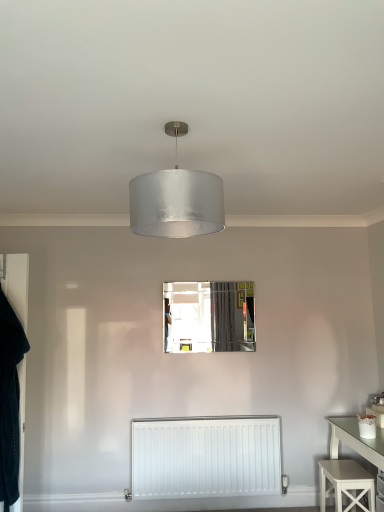
Locate an element on the screen. This screenshot has height=512, width=384. white painted wood stool at lower right is located at coordinates (346, 484).

The height and width of the screenshot is (512, 384). Describe the element at coordinates (176, 199) in the screenshot. I see `satin silver shade at center` at that location.

The width and height of the screenshot is (384, 512). What are the coordinates of `white painted wood stool at lower right` in the screenshot? It's located at (346, 484).

Is clear glass mirror at center outside of white painted wood stool at lower right?

That's correct, clear glass mirror at center is outside of white painted wood stool at lower right.

Looking at this image, is clear glass mirror at center facing towards white painted wood stool at lower right?

No, clear glass mirror at center is not aimed at white painted wood stool at lower right.

Can you confirm if clear glass mirror at center is positioned to the right of white painted wood stool at lower right?

No.

Does point (243, 301) come farther from viewer compared to point (344, 465)?

Yes.

Is velvet black robe at left smaller than white matte radiator at lower center?

Correct, velvet black robe at left occupies less space than white matte radiator at lower center.

Considering the relative positions of velvet black robe at left and white matte radiator at lower center in the image provided, is velvet black robe at left in front of white matte radiator at lower center?

Yes, it is.

From the image's perspective, which is above, velvet black robe at left or white matte radiator at lower center?

velvet black robe at left is shown above in the image.

Identify the location of radiator that is under the velvet black robe at left (from a real-world perspective). [x=205, y=457].

From a real-world perspective, is clear glass mirror at center located beneath white matte radiator at lower center?

No, from a real-world perspective, clear glass mirror at center is not under white matte radiator at lower center.

How distant is clear glass mirror at center from white matte radiator at lower center?

clear glass mirror at center is 33.72 inches away from white matte radiator at lower center.

Where is `radiator on the right of the clear glass mirror at center`? The width and height of the screenshot is (384, 512). radiator on the right of the clear glass mirror at center is located at coordinates (205, 457).

Which object is further away from the camera taking this photo, clear glass mirror at center or white matte radiator at lower center?

Positioned behind is clear glass mirror at center.

Between satin silver shade at center and velvet black robe at left, which one has more height?

Standing taller between the two is velvet black robe at left.

Considering the positions of point (173, 236) and point (12, 418), is point (173, 236) closer or farther from the camera than point (12, 418)?

Clearly, point (173, 236) is closer to the camera than point (12, 418).

Is satin silver shade at center positioned beyond the bounds of velvet black robe at left?

Yes.

Between satin silver shade at center and velvet black robe at left, which one has larger size?

Bigger between the two is satin silver shade at center.

Looking at this image, between clear glass mirror at center and velvet black robe at left, which one is positioned behind?

clear glass mirror at center.

How different are the orientations of clear glass mirror at center and velvet black robe at left in degrees?

The angle between the facing direction of clear glass mirror at center and the facing direction of velvet black robe at left is 5.43 degrees.

Is clear glass mirror at center not close to velvet black robe at left?

That's right, there is a large distance between clear glass mirror at center and velvet black robe at left.

How much distance is there between clear glass mirror at center and velvet black robe at left?

The distance of clear glass mirror at center from velvet black robe at left is 5.03 feet.

What's the angular difference between velvet black robe at left and satin silver shade at center's facing directions?

83.1 degrees separate the facing orientations of velvet black robe at left and satin silver shade at center.

Is velvet black robe at left taller than satin silver shade at center?

Yes.

Would you say velvet black robe at left is inside or outside satin silver shade at center?

A: velvet black robe at left cannot be found inside satin silver shade at center.

Between velvet black robe at left and satin silver shade at center, which one appears on the right side from the viewer's perspective?

From the viewer's perspective, satin silver shade at center appears more on the right side.

Is white painted wood stool at lower right bigger or smaller than white matte radiator at lower center?

In the image, white painted wood stool at lower right appears to be smaller than white matte radiator at lower center.

Is white painted wood stool at lower right shorter than white matte radiator at lower center?

Correct, white painted wood stool at lower right is not as tall as white matte radiator at lower center.

Between white painted wood stool at lower right and white matte radiator at lower center, which one appears on the right side from the viewer's perspective?

white painted wood stool at lower right.

Considering their positions, is white painted wood stool at lower right located in front of or behind white matte radiator at lower center?

white painted wood stool at lower right is in front of white matte radiator at lower center.

What are the coordinates of `mirror located above the white painted wood stool at lower right (from the image's perspective)` in the screenshot? It's located at (209, 316).

Where is `clothing lying on the left of white matte radiator at lower center`? The width and height of the screenshot is (384, 512). clothing lying on the left of white matte radiator at lower center is located at coordinates pyautogui.click(x=10, y=400).

Consider the image. From the image, which object appears to be farther from satin silver shade at center, white painted wood stool at lower right or velvet black robe at left?

Among the two, white painted wood stool at lower right is located further to satin silver shade at center.

From the image, which object appears to be farther from white matte radiator at lower center, clear glass mirror at center or white painted wood stool at lower right?

clear glass mirror at center is positioned further to the anchor white matte radiator at lower center.

Which object lies further to the anchor point velvet black robe at left, clear glass mirror at center or white matte radiator at lower center?

clear glass mirror at center.

From the image, which object appears to be nearer to velvet black robe at left, clear glass mirror at center or white painted wood stool at lower right?

Based on the image, clear glass mirror at center appears to be nearer to velvet black robe at left.

Based on their spatial positions, is white painted wood stool at lower right or satin silver shade at center further from velvet black robe at left?

white painted wood stool at lower right.

Looking at the image, which one is located closer to clear glass mirror at center, velvet black robe at left or satin silver shade at center?

velvet black robe at left lies closer to clear glass mirror at center than the other object.

Considering their positions, is velvet black robe at left positioned further to satin silver shade at center than white matte radiator at lower center?

Among the two, white matte radiator at lower center is located further to satin silver shade at center.

Estimate the real-world distances between objects in this image. Which object is closer to clear glass mirror at center, satin silver shade at center or velvet black robe at left?

Among the two, velvet black robe at left is located nearer to clear glass mirror at center.

Find the location of a particular element. The image size is (384, 512). clothing between satin silver shade at center and white matte radiator at lower center vertically is located at coordinates (10, 400).

I want to click on radiator between satin silver shade at center and white painted wood stool at lower right from top to bottom, so click(205, 457).

You are a GUI agent. You are given a task and a screenshot of the screen. Output one action in this format:
    pyautogui.click(x=<x>, y=<y>)
    Task: Click on the lamp situated between velvet black robe at left and white painted wood stool at lower right from left to right
    The height and width of the screenshot is (512, 384).
    Given the screenshot: What is the action you would take?
    pyautogui.click(x=176, y=199)

You are a GUI agent. You are given a task and a screenshot of the screen. Output one action in this format:
    pyautogui.click(x=<x>, y=<y>)
    Task: Click on the radiator between satin silver shade at center and clear glass mirror at center in the front-back direction
    Image resolution: width=384 pixels, height=512 pixels.
    Given the screenshot: What is the action you would take?
    pyautogui.click(x=205, y=457)